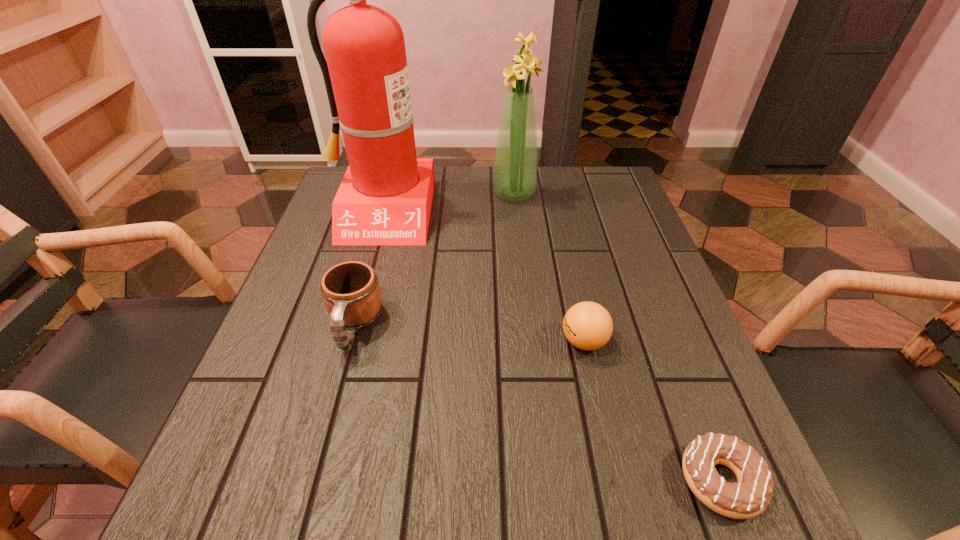
The image size is (960, 540). Find the location of `the tallest object`. the tallest object is located at coordinates (385, 198).

Image resolution: width=960 pixels, height=540 pixels. In order to click on the fourth shortest object in this screenshot , I will do coord(515,167).

Locate an element on the screen. The height and width of the screenshot is (540, 960). bouquet is located at coordinates (x=515, y=167).

Where is `mug`? This screenshot has height=540, width=960. mug is located at coordinates (351, 293).

Where is `ping-pong ball`? The height and width of the screenshot is (540, 960). ping-pong ball is located at coordinates (587, 325).

This screenshot has height=540, width=960. I want to click on the shortest object, so click(x=750, y=496).

I want to click on the nearest object, so click(750, 496).

The image size is (960, 540). Identify the location of free space located on the front-facing side of the fire extinguisher. pyautogui.click(x=345, y=341).

Locate an element on the screen. free space located on the front-facing side of the bouquet is located at coordinates (464, 194).

This screenshot has height=540, width=960. What are the coordinates of `vacant area located on the front-facing side of the bouquet` in the screenshot? It's located at (460, 194).